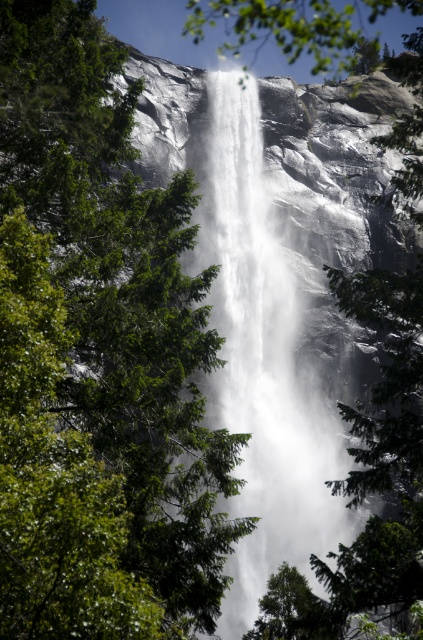
Question: Where is green leafy tree at center located in relation to white frothy water at center in the image?

Choices:
 (A) left
 (B) right

Answer: (A)

Question: Which object appears closest to the camera in this image?

Choices:
 (A) white frothy water at center
 (B) green leafy tree at center

Answer: (B)

Question: Is green leafy tree at center positioned in front of white frothy water at center?

Choices:
 (A) no
 (B) yes

Answer: (B)

Question: Does green leafy tree at center have a smaller size compared to white frothy water at center?

Choices:
 (A) no
 (B) yes

Answer: (B)

Question: Among these objects, which one is farthest from the camera?

Choices:
 (A) white frothy water at center
 (B) green leafy tree at center

Answer: (A)

Question: Which point appears closest to the camera in this image?

Choices:
 (A) (167, 552)
 (B) (293, 312)

Answer: (A)